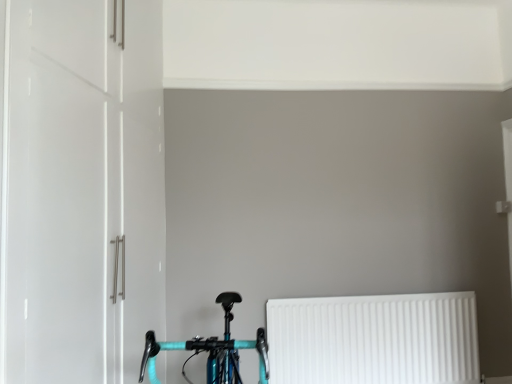
Question: From a real-world perspective, is white glossy cabinet at left on teal glossy bicycle at lower center?

Choices:
 (A) yes
 (B) no

Answer: (A)

Question: From the image's perspective, is white glossy cabinet at left over teal glossy bicycle at lower center?

Choices:
 (A) yes
 (B) no

Answer: (A)

Question: Is white glossy cabinet at left at the left side of teal glossy bicycle at lower center?

Choices:
 (A) yes
 (B) no

Answer: (A)

Question: Can you confirm if white glossy cabinet at left is bigger than teal glossy bicycle at lower center?

Choices:
 (A) yes
 (B) no

Answer: (A)

Question: Is white glossy cabinet at left positioned behind teal glossy bicycle at lower center?

Choices:
 (A) yes
 (B) no

Answer: (A)

Question: Would you say white plastic radiator at lower right is to the left or to the right of teal glossy bicycle at lower center in the picture?

Choices:
 (A) left
 (B) right

Answer: (B)

Question: Considering the positions of white plastic radiator at lower right and teal glossy bicycle at lower center in the image, is white plastic radiator at lower right bigger or smaller than teal glossy bicycle at lower center?

Choices:
 (A) big
 (B) small

Answer: (B)

Question: Relative to teal glossy bicycle at lower center, is white plastic radiator at lower right in front or behind?

Choices:
 (A) front
 (B) behind

Answer: (B)

Question: Is point (354, 327) closer or farther from the camera than point (239, 301)?

Choices:
 (A) closer
 (B) farther

Answer: (B)

Question: Considering the relative positions of teal glossy bicycle at lower center and white glossy cabinet at left in the image provided, is teal glossy bicycle at lower center to the left or to the right of white glossy cabinet at left?

Choices:
 (A) right
 (B) left

Answer: (A)

Question: Considering the positions of teal glossy bicycle at lower center and white glossy cabinet at left in the image, is teal glossy bicycle at lower center bigger or smaller than white glossy cabinet at left?

Choices:
 (A) small
 (B) big

Answer: (A)

Question: Does point (226, 367) appear closer or farther from the camera than point (93, 185)?

Choices:
 (A) closer
 (B) farther

Answer: (A)

Question: Is teal glossy bicycle at lower center situated inside white glossy cabinet at left or outside?

Choices:
 (A) outside
 (B) inside

Answer: (A)

Question: From a real-world perspective, is white plastic radiator at lower right physically located above or below white glossy cabinet at left?

Choices:
 (A) above
 (B) below

Answer: (B)

Question: Is white plastic radiator at lower right wider or thinner than white glossy cabinet at left?

Choices:
 (A) wide
 (B) thin

Answer: (B)